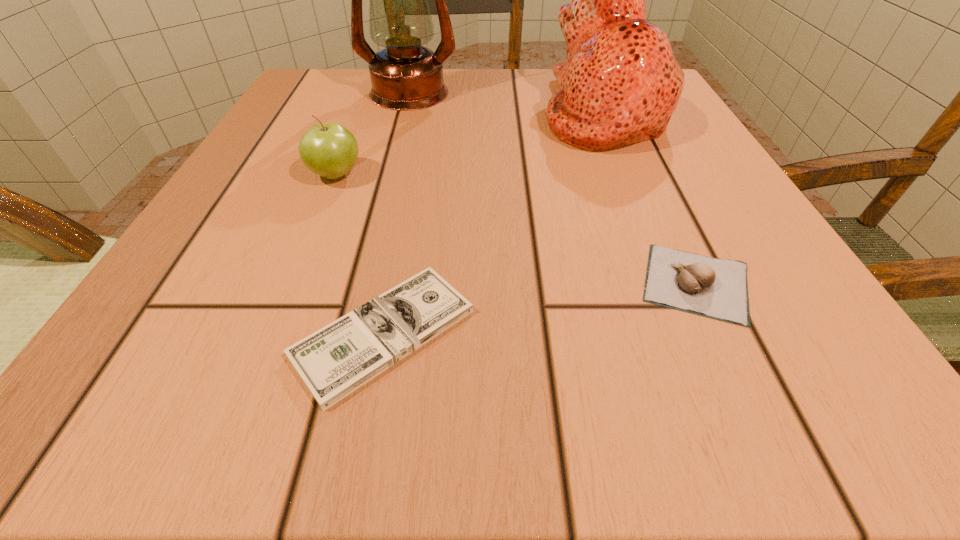
This screenshot has width=960, height=540. Identify the location of vacant region located 0.110m on the right of the third shortest object. (435, 175).

Locate an element on the screen. The width and height of the screenshot is (960, 540). vacant region located 0.050m on the back of the garlic is located at coordinates (666, 220).

This screenshot has height=540, width=960. What are the coordinates of `blank space located 0.230m on the back of the shortest object` in the screenshot? It's located at (415, 168).

You are a GUI agent. You are given a task and a screenshot of the screen. Output one action in this format:
    pyautogui.click(x=<x>, y=<y>)
    Task: Click on the oil lamp that is at the far edge
    Image resolution: width=960 pixels, height=540 pixels.
    Given the screenshot: What is the action you would take?
    pyautogui.click(x=405, y=76)

Locate an element on the screen. The width and height of the screenshot is (960, 540). cat situated at the far edge is located at coordinates (620, 84).

Identify the location of object at the near edge. This screenshot has width=960, height=540. (336, 360).

Identify the location of oil lamp present at the left edge. (405, 76).

Find the location of `apple situated at the left edge`. apple situated at the left edge is located at coordinates (330, 150).

Find the location of a particular element. This screenshot has width=960, height=540. cat situated at the right edge is located at coordinates (620, 84).

The width and height of the screenshot is (960, 540). I want to click on garlic situated at the right edge, so click(x=716, y=288).